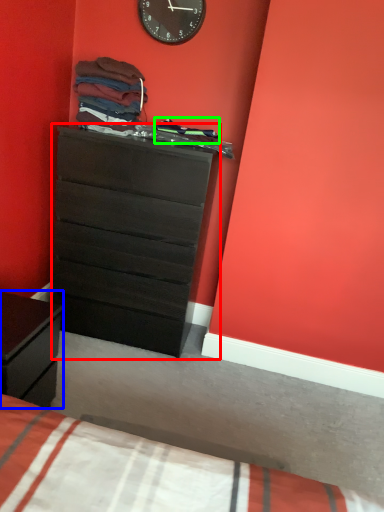
Question: Estimate the real-world distances between objects in this image. Which object is farther from chest of drawers (highlighted by a red box), nightstand (highlighted by a blue box) or clothing (highlighted by a green box)?

Choices:
 (A) nightstand
 (B) clothing

Answer: (A)